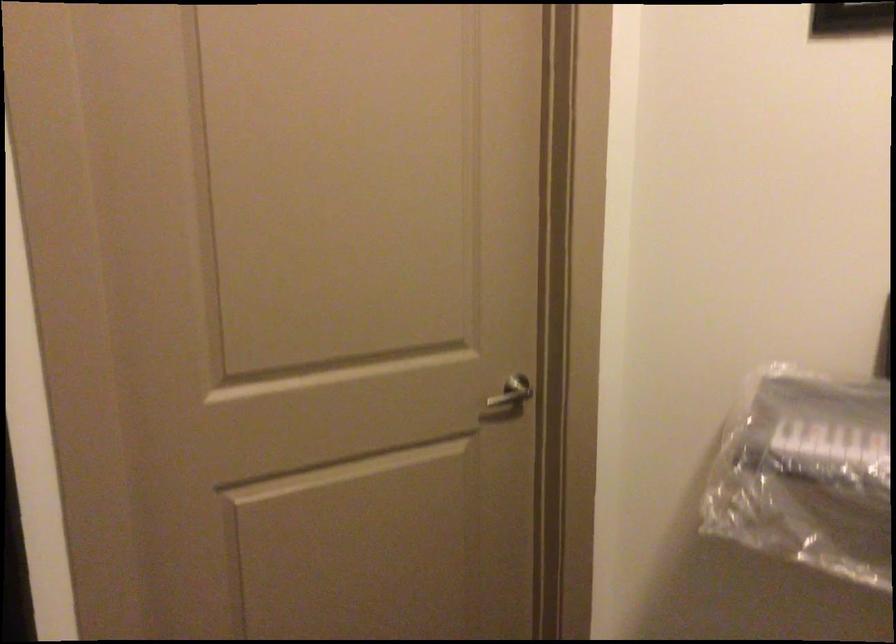
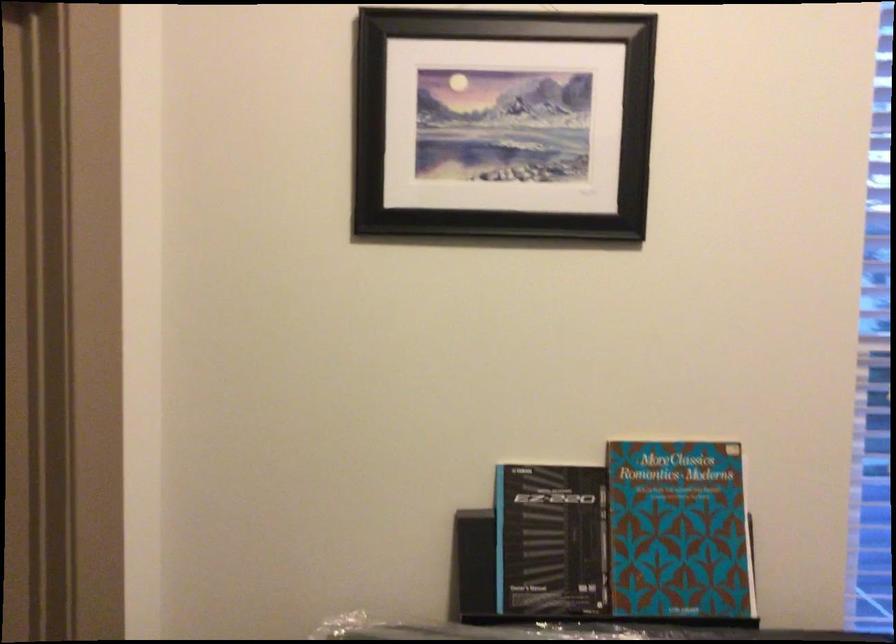
Which direction would the cameraman need to move to produce the second image?

The movement direction of the cameraman is right, forward.